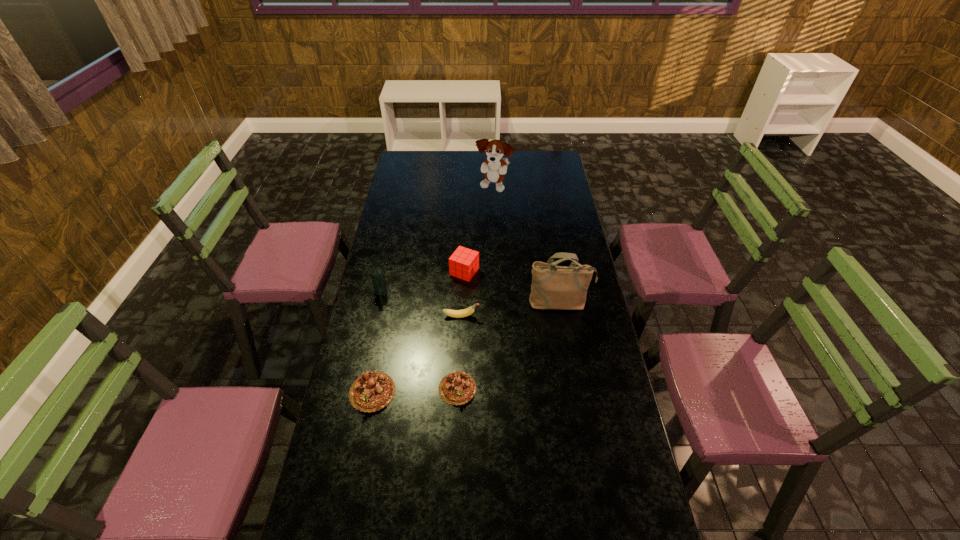
Image resolution: width=960 pixels, height=540 pixels. What are the coordinates of `the left chocolate cake` in the screenshot? It's located at tap(372, 391).

This screenshot has height=540, width=960. Find the location of `the shorter chocolate cake`. the shorter chocolate cake is located at coordinates (456, 388).

This screenshot has width=960, height=540. Find the location of `the right chocolate cake`. the right chocolate cake is located at coordinates (456, 388).

Where is `puppy`? puppy is located at coordinates (494, 167).

Identify the location of the fifth shortest object. The width and height of the screenshot is (960, 540). (378, 279).

This screenshot has height=540, width=960. I want to click on banana, so click(465, 312).

What are the coordinates of `the second farthest object` in the screenshot? It's located at (463, 263).

The image size is (960, 540). I want to click on the fourth shortest object, so [x=463, y=263].

Locate an element on the screen. the rightmost object is located at coordinates (555, 287).

The width and height of the screenshot is (960, 540). I want to click on free space located on the front of the left chocolate cake, so click(x=360, y=454).